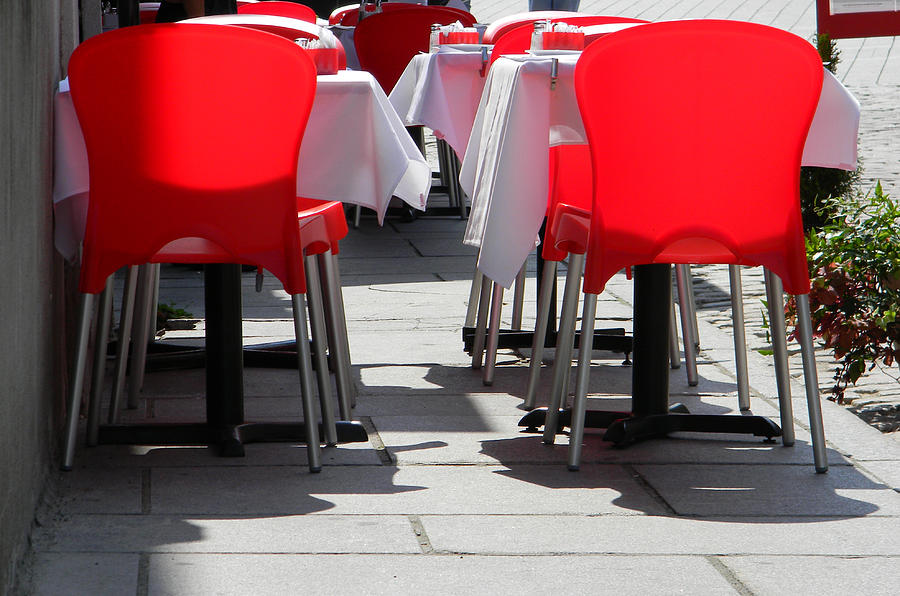
Locate an element on the screen. The image size is (900, 596). red chairs is located at coordinates 645,102, 227,91, 515,41, 290,27, 302,11, 339,11, 501,26, 388,29, 462,13.